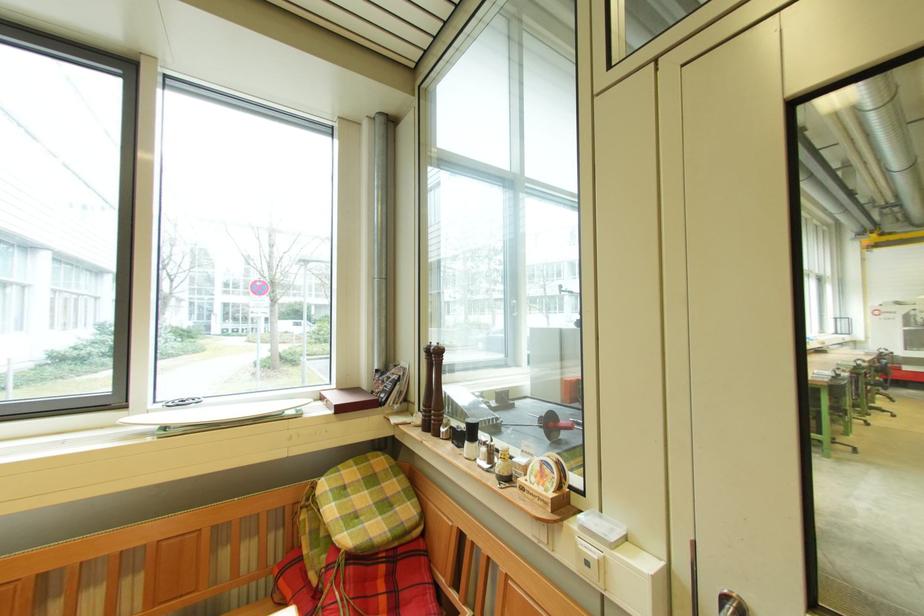
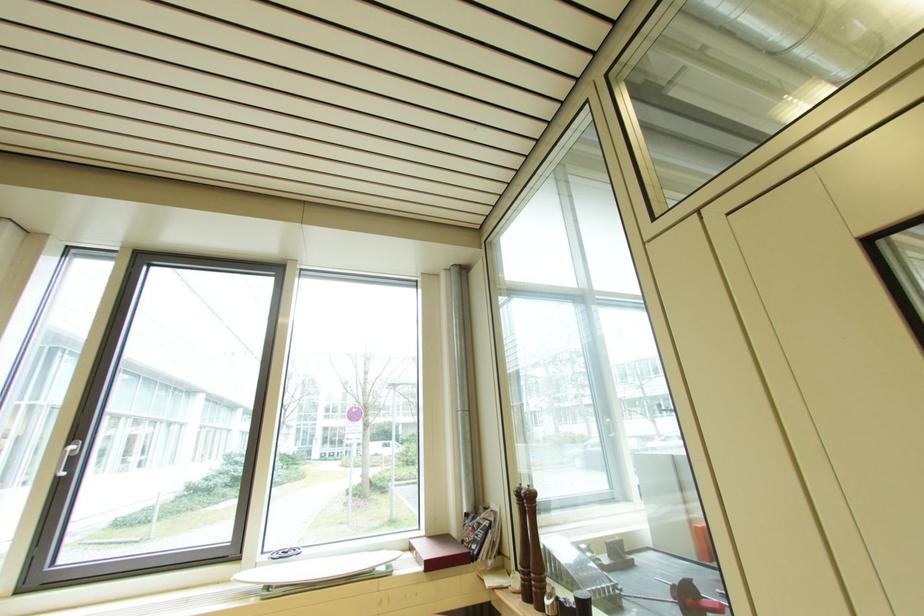
In the second image, find the point that corresponds to point (466, 431) in the first image.

(574, 605)